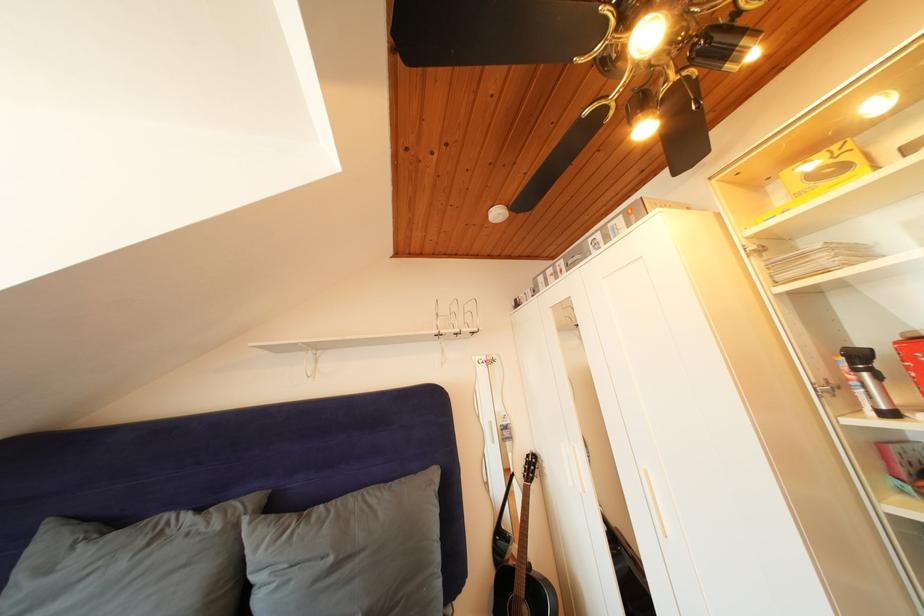
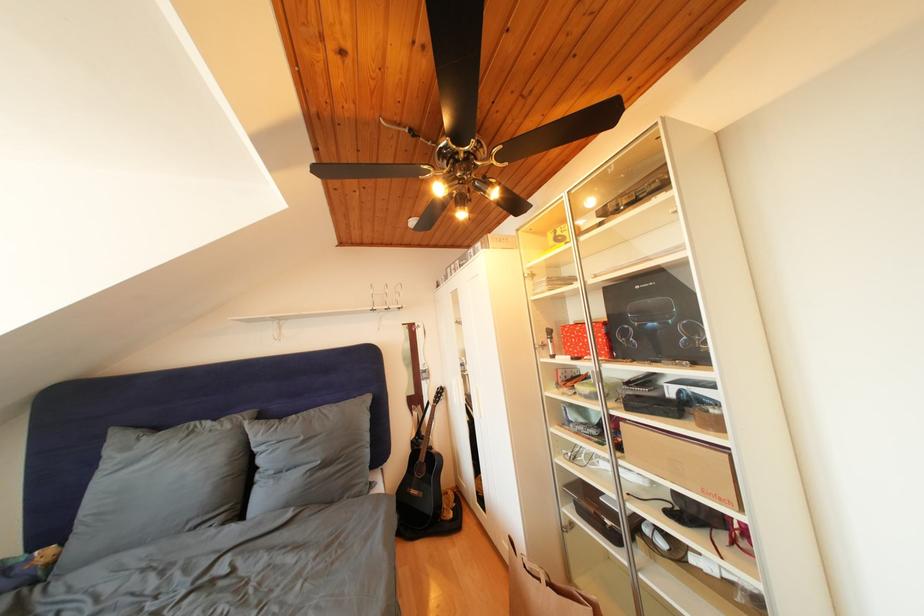
Question: I am providing you with two images of the same scene from different viewpoints. Please identify which objects are invisible in image2.

Choices:
 (A) large grey pillow
 (B) silver cabinet handle
 (C) fan pull chain
 (D) none of these

Answer: (D)